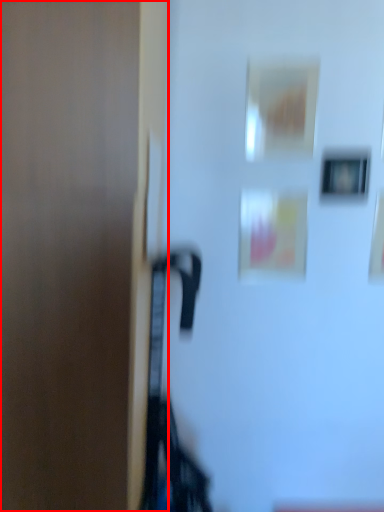
Question: Where is door (annotated by the red box) located in relation to picture frame in the image?

Choices:
 (A) left
 (B) right

Answer: (A)